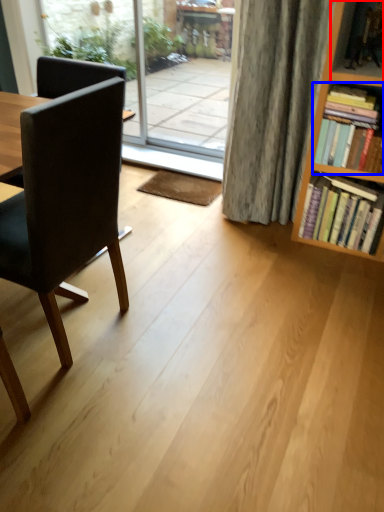
Question: Which object appears farthest to the camera in this image, shelf (highlighted by a red box) or book (highlighted by a blue box)?

Choices:
 (A) shelf
 (B) book

Answer: (B)